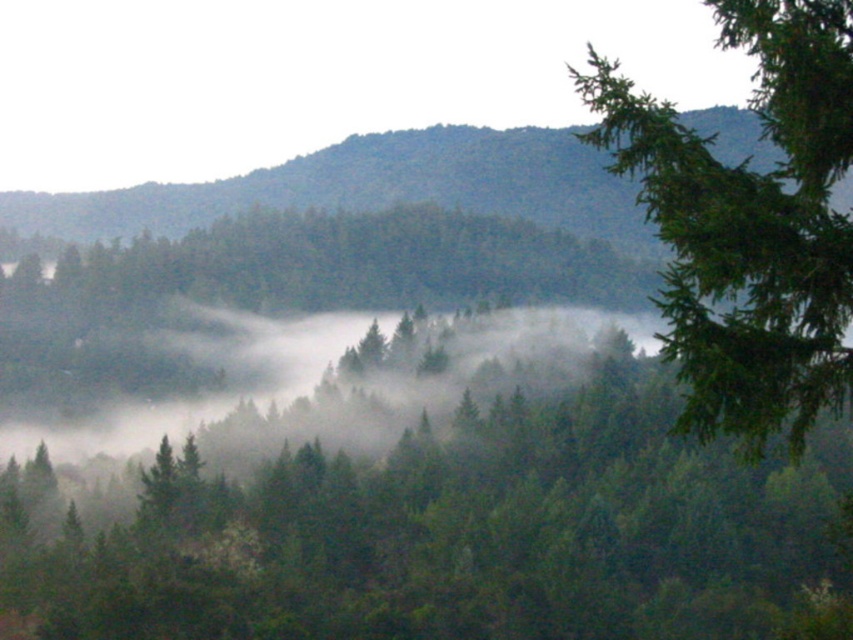
You are an environmental scientist studying the distribution of tree species in this forest. You notice a specific point marked at coordinates point [750,225]. What type of tree feature is located at this point?

The point [750,225] marks a green needle like tree feature at upper right.

You are standing in the forest and see two points marked in the image. Which point is closer to you, point (395, 372) or point (770, 392)?

Point (770, 392) is closer to you because it is in front of point (395, 372).